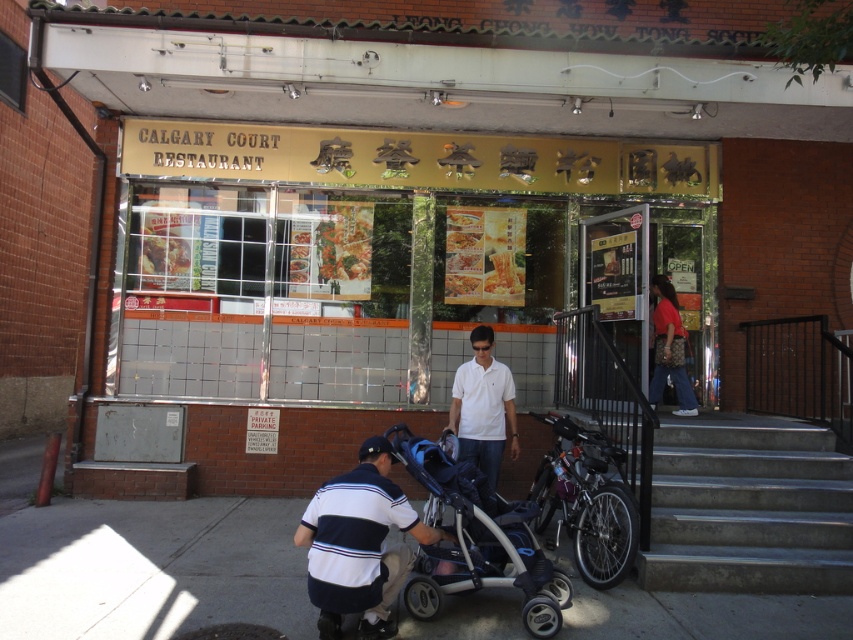
You are standing in front of Calgary Court Restaurant and need to enter. Where are the concrete steps at center located?

The concrete steps at center are located at point (747, 508).

You are a delivery person standing at the entrance of Calgary Court Restaurant. You need to place a heavy box on the ground. Which object, the gray concrete pavement at lower left or the white matte shirt at center, is more suitable for placing the box to ensure it doesn not get damaged?

The gray concrete pavement at lower left is more suitable for placing the box because it is not as tall as the white matte shirt at center, meaning the pavement is lower to the ground and provides a stable, flat surface for the box.